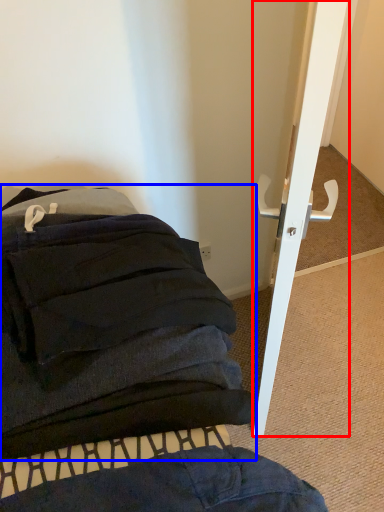
Question: Which of the following is the closest to the observer, door (highlighted by a red box) or furniture (highlighted by a blue box)?

Choices:
 (A) door
 (B) furniture

Answer: (B)